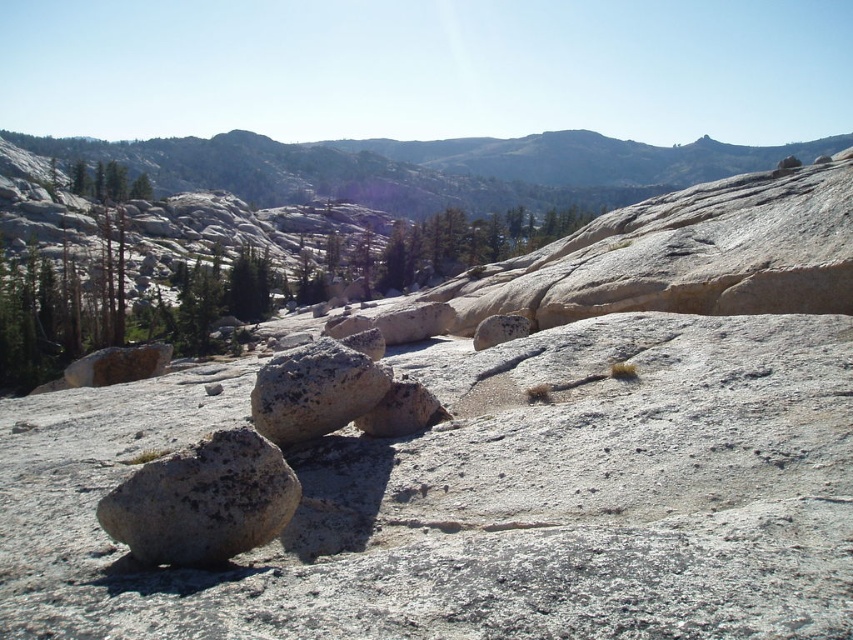
Question: Can you confirm if rusty metallic rock at center is wider than green matte tree at upper left?

Choices:
 (A) no
 (B) yes

Answer: (A)

Question: Can you confirm if gray rough rock at lower left is thinner than rusty metallic rock at center?

Choices:
 (A) yes
 (B) no

Answer: (B)

Question: Among these objects, which one is farthest from the camera?

Choices:
 (A) gray rough rock at center
 (B) rusty metallic rock at center

Answer: (B)

Question: Which point is closer to the camera?

Choices:
 (A) rusty metallic rock at left
 (B) green matte tree at upper left
 (C) smooth gray rock at center
 (D) rusty metallic rock at center

Answer: (D)

Question: Does gray rough rock at lower left have a greater width compared to gray rough rock at center?

Choices:
 (A) yes
 (B) no

Answer: (B)

Question: Which object is the closest to the rusty metallic rock at left?

Choices:
 (A) smooth gray rock at center
 (B) rusty metallic rock at center

Answer: (A)